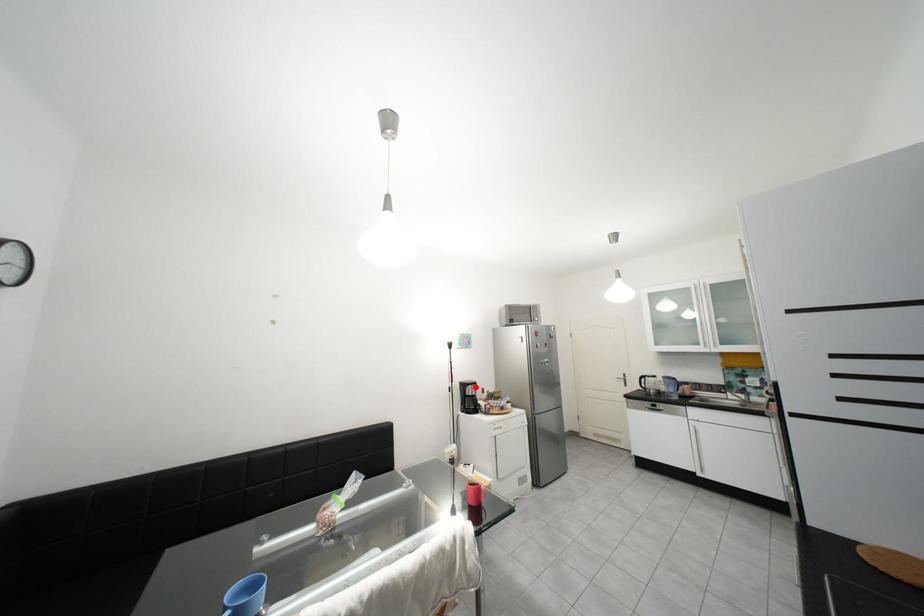
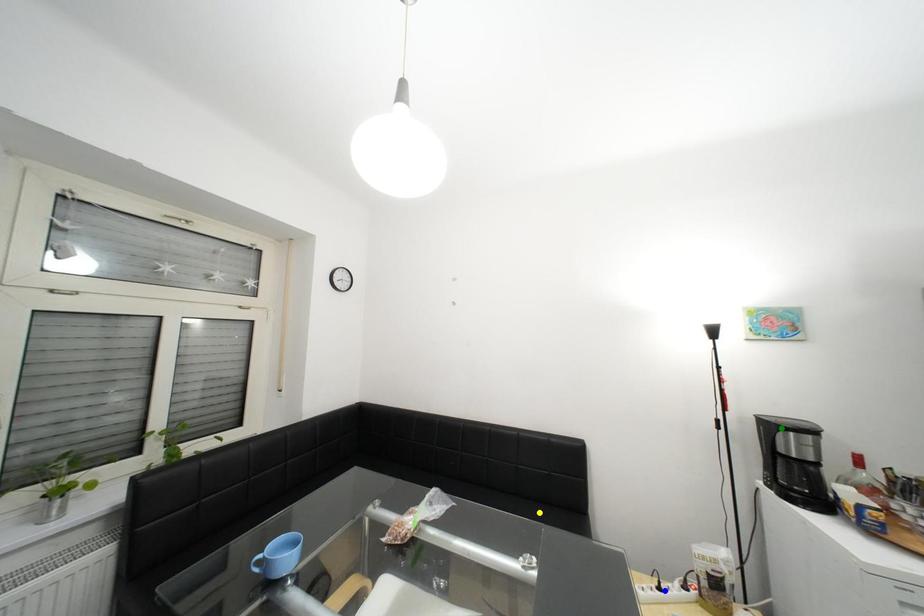
Question: I am providing you with two images of the same scene from different viewpoints. A red point is marked on the first image. You are given multiple points on the second image. Which spot in image 2 lines up with the point in image 1?

Choices:
 (A) yellow point
 (B) blue point
 (C) green point

Answer: (C)